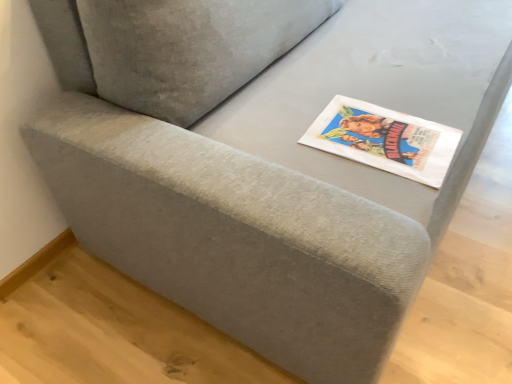
You are a GUI agent. You are given a task and a screenshot of the screen. Output one action in this format:
    pyautogui.click(x=<x>, y=<y>)
    Task: Click on the matte paper poster at center
    This screenshot has width=512, height=384.
    Given the screenshot: What is the action you would take?
    pyautogui.click(x=384, y=139)

This screenshot has height=384, width=512. What do you see at coordinates (384, 139) in the screenshot? I see `matte paper poster at center` at bounding box center [384, 139].

Where is `matte paper poster at center`? Image resolution: width=512 pixels, height=384 pixels. matte paper poster at center is located at coordinates (384, 139).